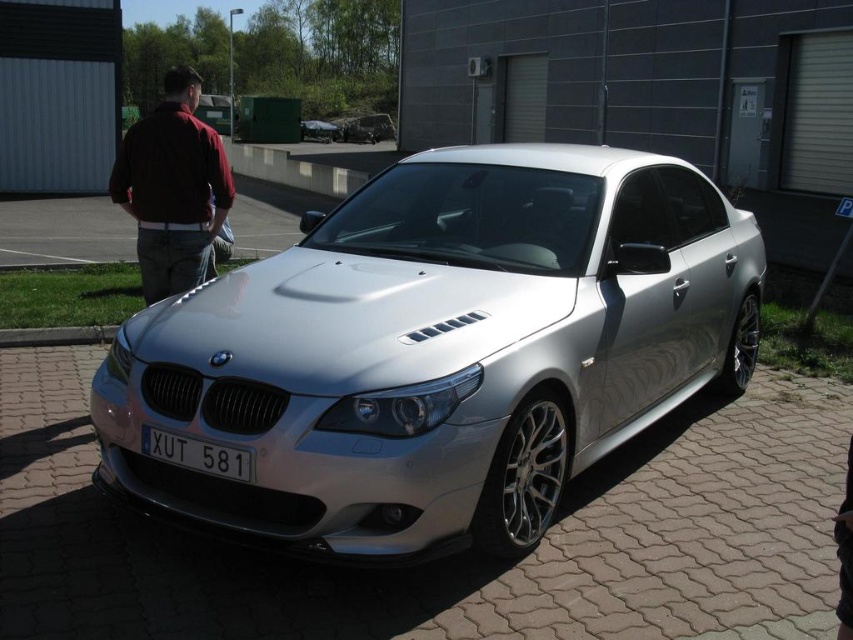
Question: Estimate the real-world distances between objects in this image. Which object is farther from the maroon fabric shirt at left?

Choices:
 (A) silver metallic car at center
 (B) satin silver car at center

Answer: (A)

Question: Can you confirm if maroon fabric shirt at left is positioned above silver metallic car at center?

Choices:
 (A) no
 (B) yes

Answer: (A)

Question: Where is white plastic license plate at center located in relation to silver metallic car at center in the image?

Choices:
 (A) below
 (B) above

Answer: (A)

Question: Does satin silver car at center have a greater width compared to silver metallic car at center?

Choices:
 (A) yes
 (B) no

Answer: (A)

Question: Which point is closer to the camera taking this photo?

Choices:
 (A) (173, 369)
 (B) (305, 138)
 (C) (239, 470)

Answer: (C)

Question: Among these objects, which one is farthest from the camera?

Choices:
 (A) white plastic license plate at center
 (B) satin silver car at center
 (C) maroon fabric shirt at left
 (D) silver metallic car at center

Answer: (D)